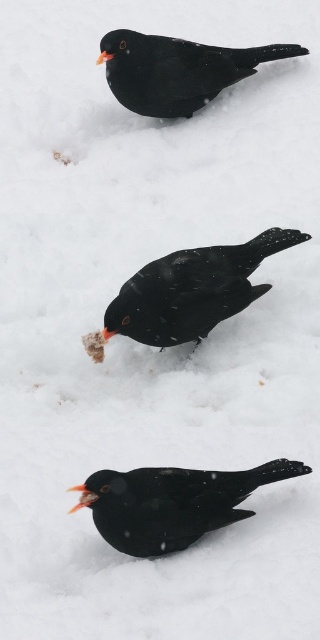
You are a photographer aiming to capture the shiny black bird at center in your shot. The camera is positioned at point A, which is directly to the left of the bird. To ensure the bird is in the center of the frame, should you move the camera to the right or left?

Since the camera is at point A directly to the left of the shiny black bird at center, moving it to the right would align the bird in the center of the frame.

You are a photographer aiming to capture a clear photo of both the matte black bird at center and the shiny black crow at upper center. Since the birds are layered, which bird should you focus on first to ensure both are in focus?

To ensure both the matte black bird at center and the shiny black crow at upper center are in focus, you should focus on the shiny black crow at upper center first, as it is positioned above the matte black bird at center, allowing the depth of field to cover both layers.